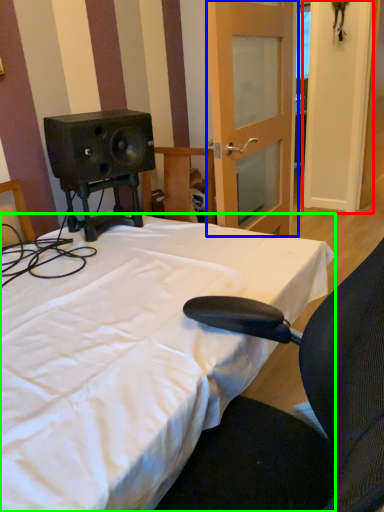
Question: Considering the real-world distances, which object is farthest from door (highlighted by a red box)? door (highlighted by a blue box) or bed (highlighted by a green box)?

Choices:
 (A) door
 (B) bed

Answer: (B)